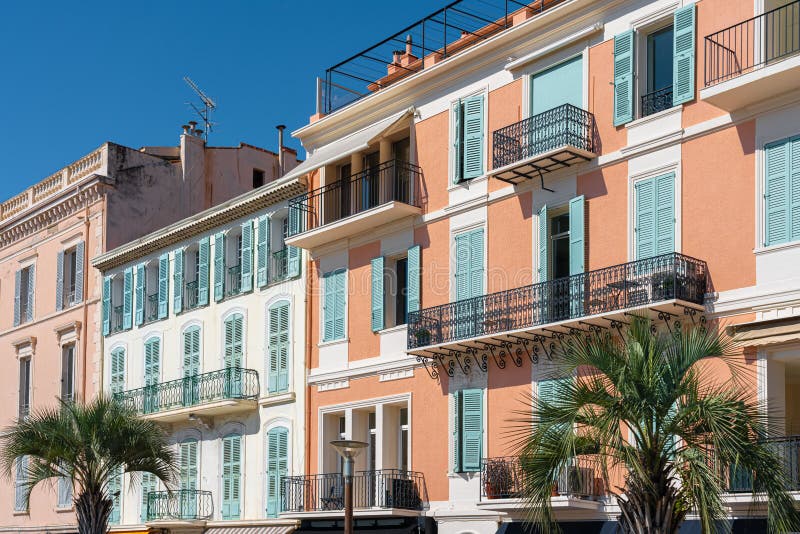
Image resolution: width=800 pixels, height=534 pixels. Identify the location of door. (373, 463), (404, 460), (338, 468), (556, 233).